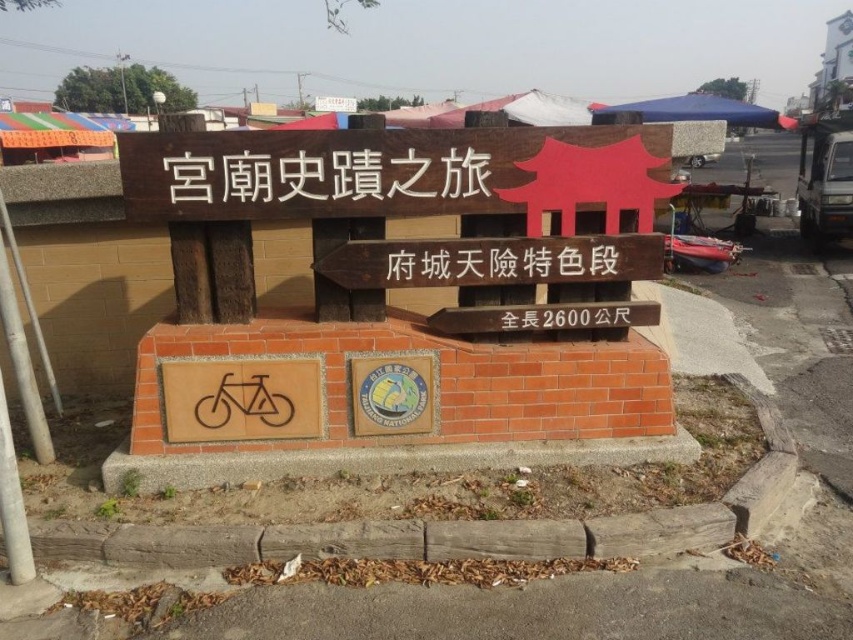
Question: Among these objects, which one is nearest to the camera?

Choices:
 (A) black wood sign at center
 (B) brown wooden sign at center
 (C) black plastic text at center
 (D) wooden signboard at center

Answer: (B)

Question: Which object is positioned closest to the wooden signboard at center?

Choices:
 (A) brown wooden sign at center
 (B) brown wood bicycle at center
 (C) black wood sign at center

Answer: (B)

Question: Considering the relative positions of black wood sign at center and wooden signboard at center in the image provided, where is black wood sign at center located with respect to wooden signboard at center?

Choices:
 (A) above
 (B) below

Answer: (A)

Question: Does brown wood bicycle at center lie behind black plastic text at center?

Choices:
 (A) no
 (B) yes

Answer: (A)

Question: Which object is the closest to the black plastic text at center?

Choices:
 (A) wooden signboard at center
 (B) brown wooden sign at center

Answer: (A)

Question: Does brown wood bicycle at center have a greater width compared to wooden signboard at center?

Choices:
 (A) yes
 (B) no

Answer: (A)